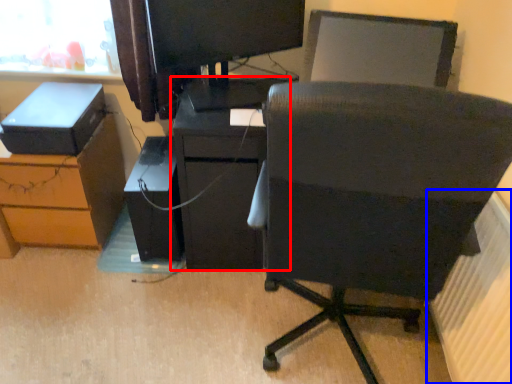
Question: Which point is closer to the camera, furniture (highlighted by a red box) or radiator (highlighted by a blue box)?

Choices:
 (A) furniture
 (B) radiator

Answer: (B)